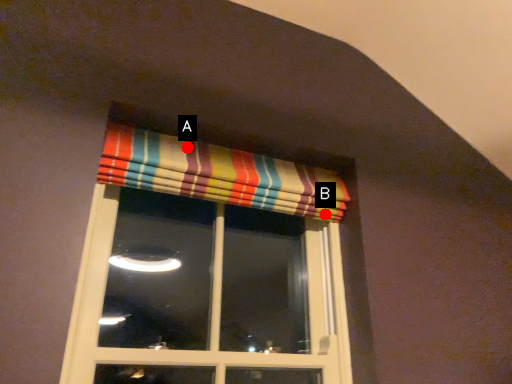
Question: Two points are circled on the image, labeled by A and B beside each circle. Which point is further to the camera?

Choices:
 (A) A is further
 (B) B is further

Answer: (B)